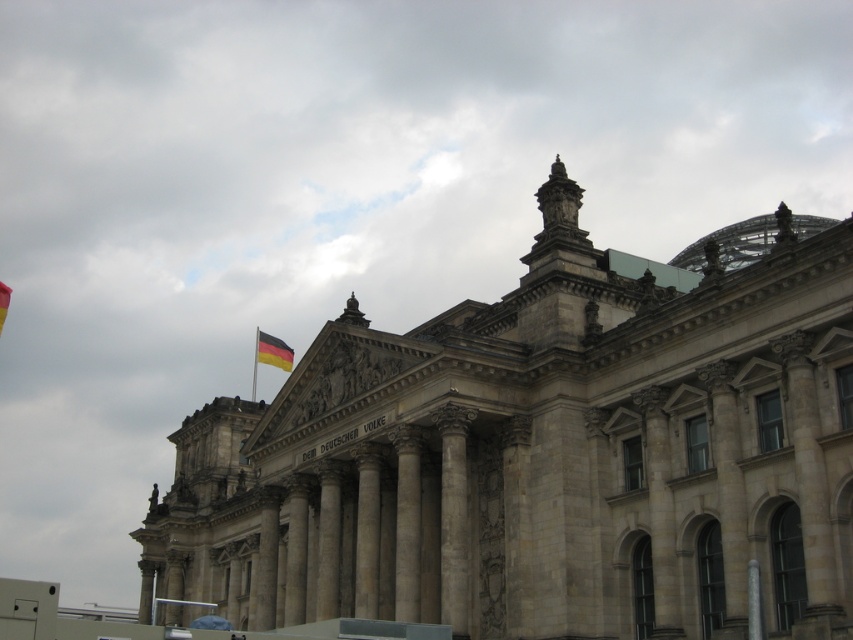
You are standing at the base of the grand neoclassical building and want to take a photo of the german flag at center. If the recommended distance for clear photography is 100 meters, will you be able to capture the flag clearly from your current position?

The distance of german flag at center from camera is 97.89 meters, which is less than the recommended 100 meters. Therefore, you can capture the flag clearly from your current position.